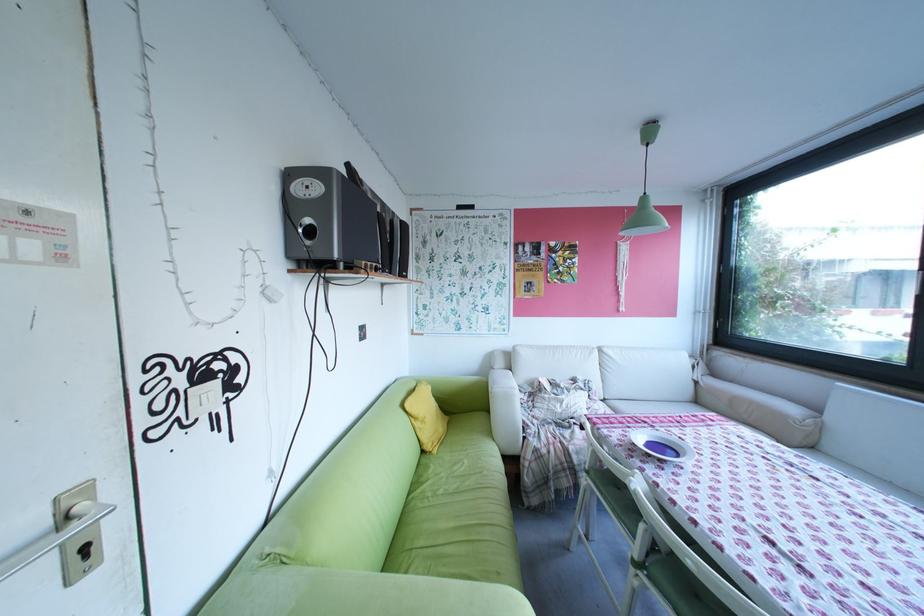
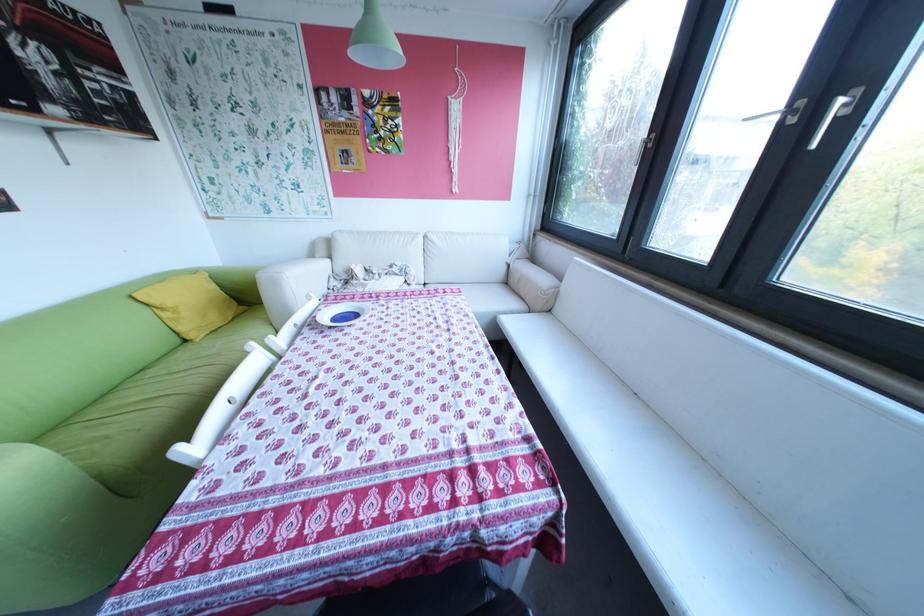
Question: Which direction would the cameraman need to move to produce the second image? Reply with the corresponding letter.

Choices:
 (A) Left
 (B) Right
 (C) Forward
 (D) Backward

Answer: (B)